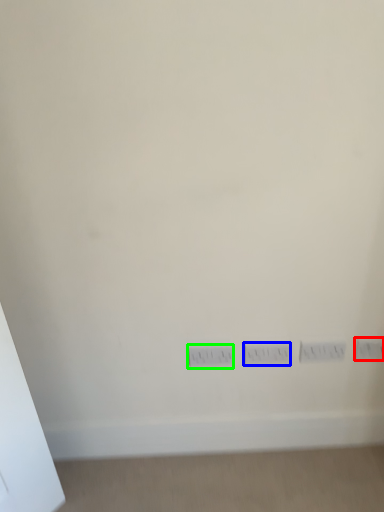
Question: Which object is positioned closest to electric outlet (highlighted by a red box)? Select from switch (highlighted by a blue box) and power plugs and sockets (highlighted by a green box).

Choices:
 (A) switch
 (B) power plugs and sockets

Answer: (A)